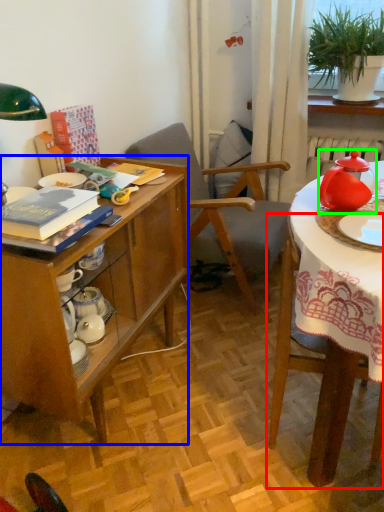
Question: Considering the real-world distances, which object is closest to chair (highlighted by a red box)? desk (highlighted by a blue box) or tableware (highlighted by a green box).

Choices:
 (A) desk
 (B) tableware

Answer: (B)